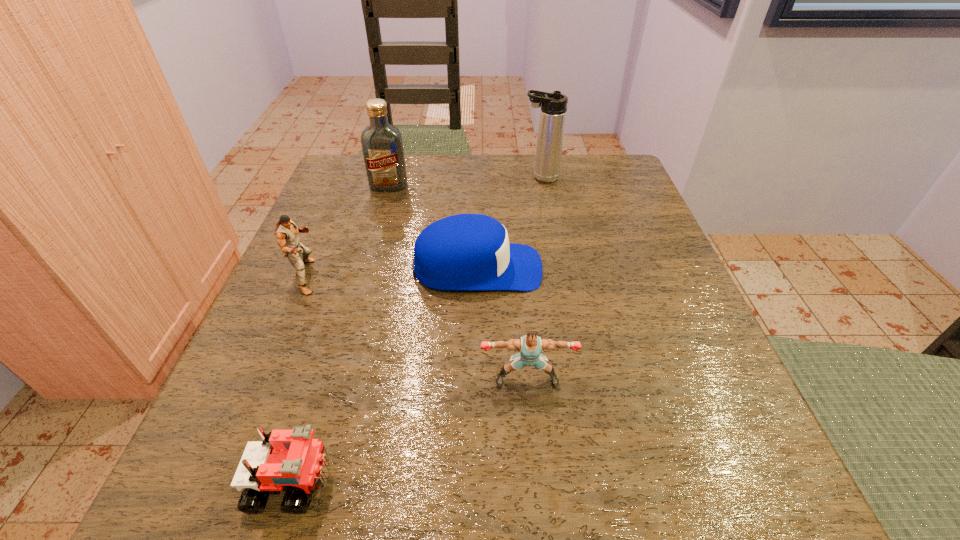
Locate an element on the screen. vacant space in between the baseball cap and the third tallest object is located at coordinates (392, 273).

At what (x,y) coordinates should I click in order to perform the action: click on free space between the vodka and the thermos bottle. Please return your answer as a coordinate pair (x, y). The height and width of the screenshot is (540, 960). Looking at the image, I should click on (465, 182).

Image resolution: width=960 pixels, height=540 pixels. In order to click on free spot between the Lego and the baseball cap in this screenshot , I will do `click(385, 375)`.

This screenshot has width=960, height=540. I want to click on unoccupied area between the baseball cap and the thermos bottle, so click(x=509, y=223).

The image size is (960, 540). Find the location of `vacant area between the thermos bottle and the nearest object`. vacant area between the thermos bottle and the nearest object is located at coordinates (417, 329).

Image resolution: width=960 pixels, height=540 pixels. Find the location of `free spot between the thermos bottle and the baseball cap`. free spot between the thermos bottle and the baseball cap is located at coordinates pyautogui.click(x=509, y=223).

The width and height of the screenshot is (960, 540). I want to click on vacant area between the nearer puncher and the left puncher, so click(x=417, y=328).

Identify which object is located as the fifth nearest to the thermos bottle. Please provide its 2D coordinates. Your answer should be formatted as a tuple, i.e. [(x, y)], where the tuple contains the x and y coordinates of a point satisfying the conditions above.

[(286, 458)]

Select which object is the fourth closest to the Lego. Please provide its 2D coordinates. Your answer should be formatted as a tuple, i.e. [(x, y)], where the tuple contains the x and y coordinates of a point satisfying the conditions above.

[(382, 145)]

You are a GUI agent. You are given a task and a screenshot of the screen. Output one action in this format:
    pyautogui.click(x=<x>, y=<y>)
    Task: Click on the free point that satisfies the following two spatial constraints: 1. on the front-facing side of the nearer puncher; 2. on the front-facing side of the Lego
    
    Given the screenshot: What is the action you would take?
    pyautogui.click(x=536, y=481)